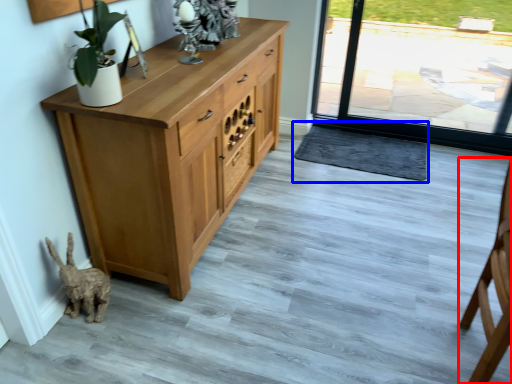
Question: Which object is closer to the camera taking this photo, chair (highlighted by a red box) or doormat (highlighted by a blue box)?

Choices:
 (A) chair
 (B) doormat

Answer: (A)